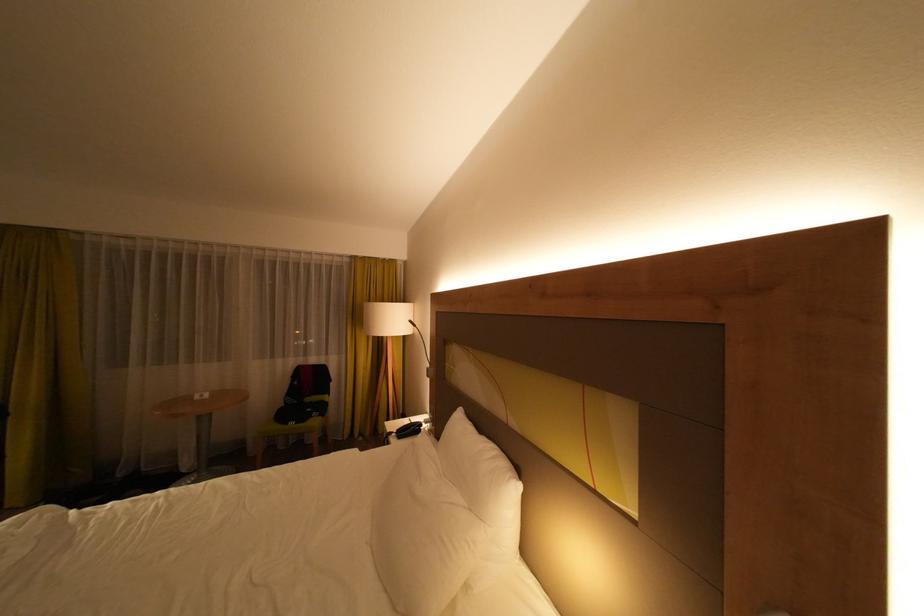
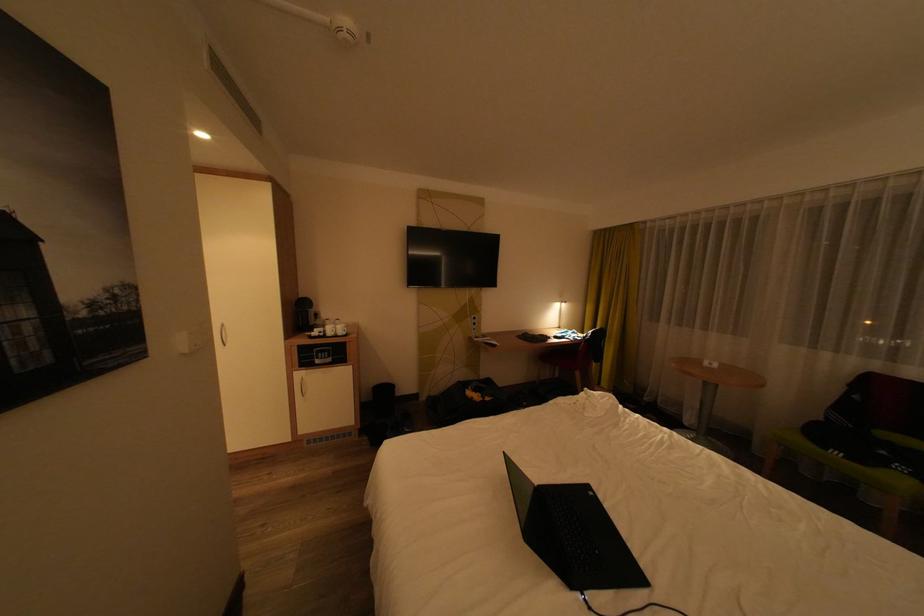
Find the pixel in the second image that matches the point at 324,422 in the first image.

(906, 480)